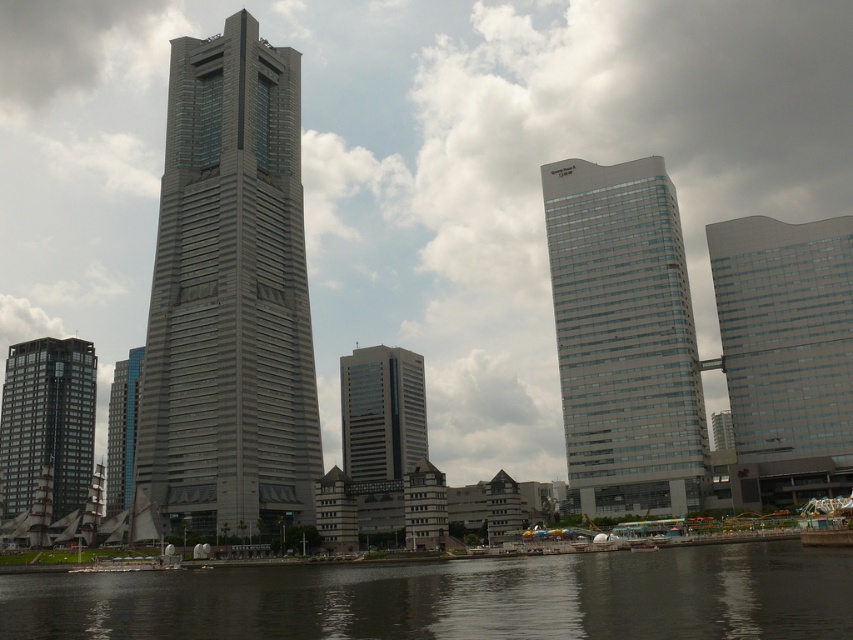
Is point (686, 547) positioned before point (399, 369)?

Yes.

Which is in front, point (831, 564) or point (344, 472)?

Point (831, 564) is in front.

Is point (183, 596) less distant than point (347, 394)?

That is True.

Image resolution: width=853 pixels, height=640 pixels. Identify the location of dark gray water at lower center. (457, 598).

Can you confirm if gray glass skyscraper at left is positioned above smooth glass skyscraper at right?

Indeed, gray glass skyscraper at left is positioned over smooth glass skyscraper at right.

Is point (172, 129) farther from camera compared to point (747, 438)?

Yes, it is behind point (747, 438).

Image resolution: width=853 pixels, height=640 pixels. I want to click on gray glass skyscraper at left, so click(x=229, y=296).

Is dark gray glass building at left thinner than gray glass skyscraper at center?

Incorrect, dark gray glass building at left's width is not less than gray glass skyscraper at center's.

Which is below, dark gray glass building at left or gray glass skyscraper at center?

dark gray glass building at left is lower down.

Which is in front, point (83, 417) or point (364, 374)?

Point (83, 417) is more forward.

Image resolution: width=853 pixels, height=640 pixels. Identify the location of dark gray glass building at left. (47, 420).